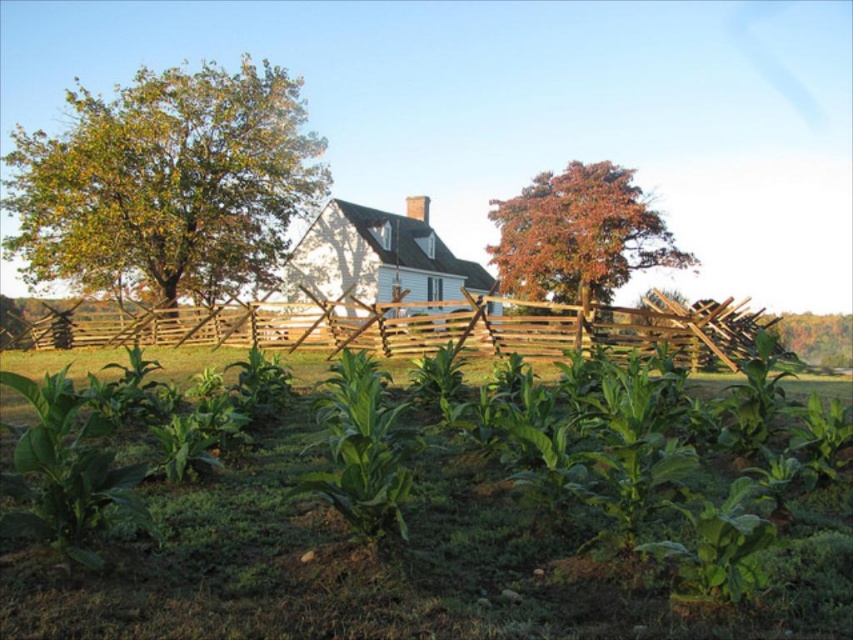
Question: Is green leafy tree at upper left to the left of orange-brown bark tree at upper center from the viewer's perspective?

Choices:
 (A) yes
 (B) no

Answer: (A)

Question: Estimate the real-world distances between objects in this image. Which object is closer to the wooden fence at center?

Choices:
 (A) orange-brown bark tree at upper center
 (B) green leafy plants at center
 (C) green leafy tree at upper left

Answer: (A)

Question: Can you confirm if wooden fence at center is positioned above orange-brown bark tree at upper center?

Choices:
 (A) no
 (B) yes

Answer: (A)

Question: Does green leafy plants at center appear over green leafy tree at upper left?

Choices:
 (A) no
 (B) yes

Answer: (A)

Question: Which of the following is the farthest from the observer?

Choices:
 (A) green leafy tree at upper left
 (B) orange-brown bark tree at upper center
 (C) green leafy plants at center
 (D) wooden fence at center

Answer: (A)

Question: Which point is closer to the camera taking this photo?

Choices:
 (A) (120, 323)
 (B) (339, 465)

Answer: (B)